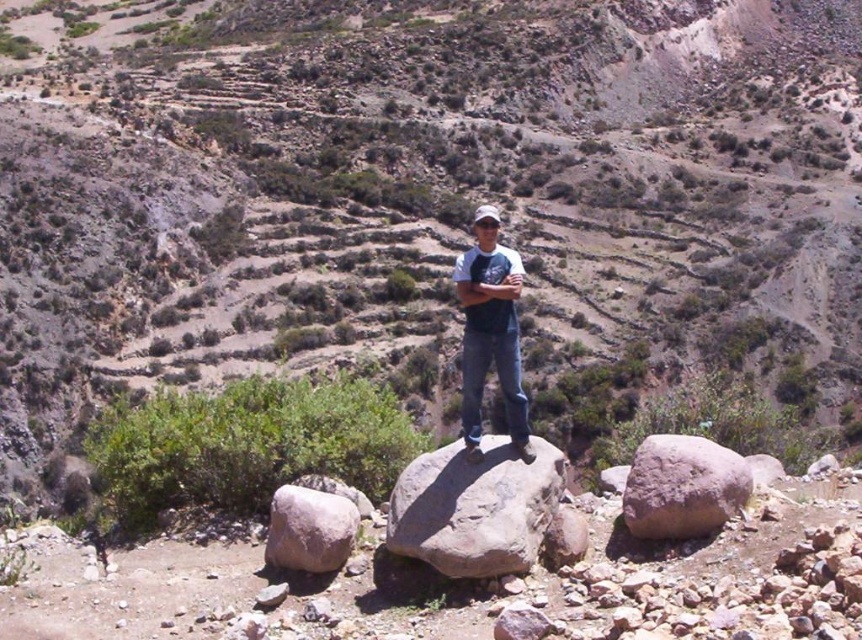
You are a photographer trying to capture the gray rough rock at center and the denim jeans at center in a single shot. Based on their sizes, which object should you focus on first to ensure both are in frame?

The gray rough rock at center is not as tall as the denim jeans at center, so you should focus on the denim jeans at center first to ensure both are in frame.

In the scene shown: You are a photographer trying to capture the gray rough rock at center and the denim jeans at center in the same frame. Based on their positions, which object will appear larger in the photo?

The gray rough rock at center will appear larger in the photo because it is closer to the viewer than the denim jeans at center.